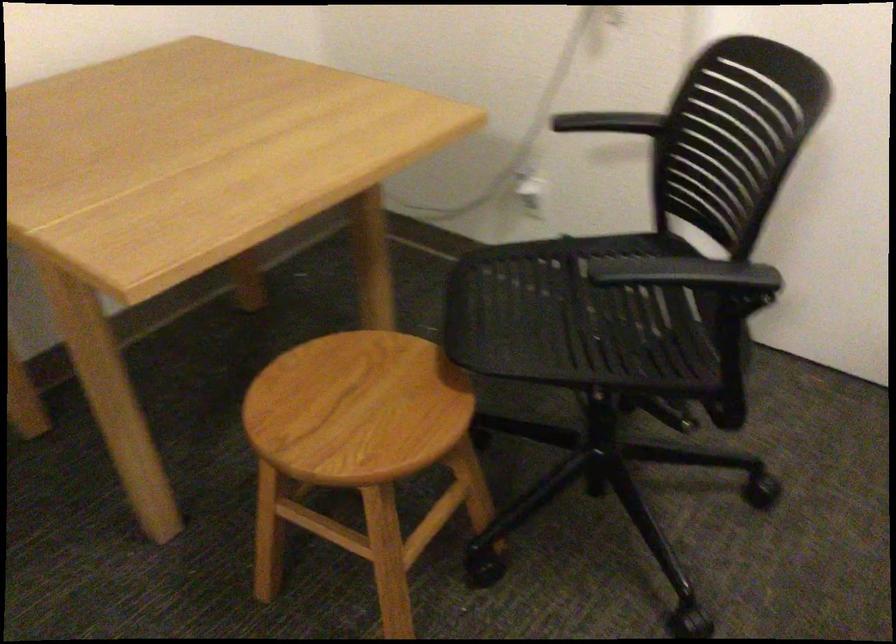
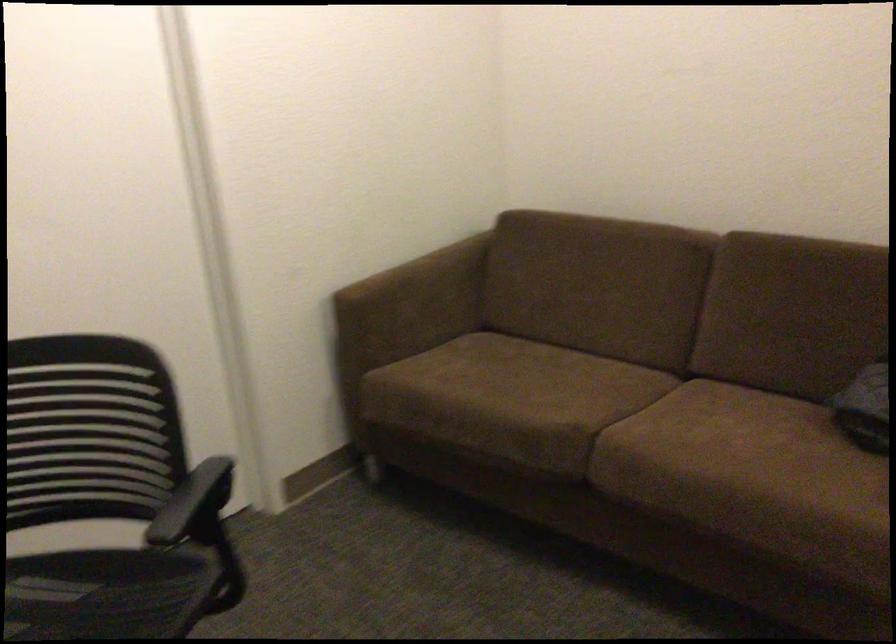
Question: The images are taken continuously from a first-person perspective. In which direction is your viewpoint rotating?

Choices:
 (A) Left
 (B) Right
 (C) Up
 (D) Down

Answer: (B)